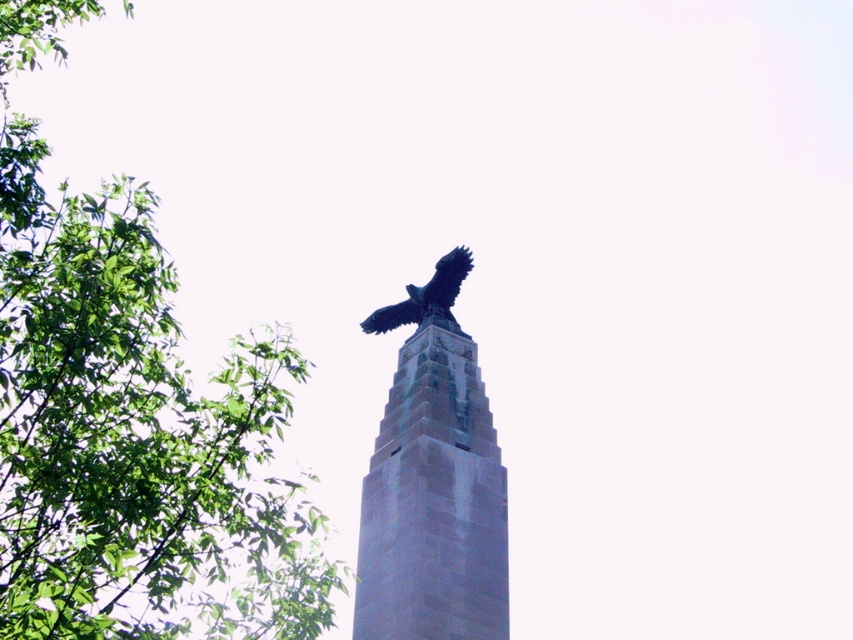
Question: Does green leafy tree at upper left have a smaller size compared to slate gray stone tower at upper center?

Choices:
 (A) no
 (B) yes

Answer: (A)

Question: Which point is closer to the camera taking this photo?

Choices:
 (A) [x=126, y=426]
 (B) [x=448, y=260]
 (C) [x=503, y=620]

Answer: (C)

Question: Which of these objects is positioned farthest from the shiny black eagle at upper center?

Choices:
 (A) green leafy tree at upper left
 (B) slate gray stone tower at upper center

Answer: (A)

Question: Considering the real-world distances, which object is closest to the shiny black eagle at upper center?

Choices:
 (A) slate gray stone tower at upper center
 (B) green leafy tree at upper left

Answer: (A)

Question: Does green leafy tree at upper left appear on the right side of slate gray stone tower at upper center?

Choices:
 (A) yes
 (B) no

Answer: (B)

Question: Does slate gray stone tower at upper center lie in front of shiny black eagle at upper center?

Choices:
 (A) yes
 (B) no

Answer: (A)